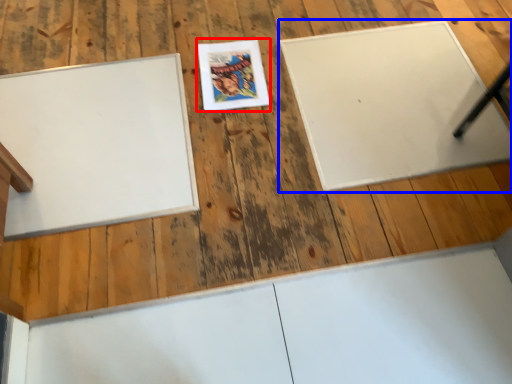
Question: Which point is further to the camera, comic book (highlighted by a red box) or bulletin board (highlighted by a blue box)?

Choices:
 (A) comic book
 (B) bulletin board

Answer: (A)